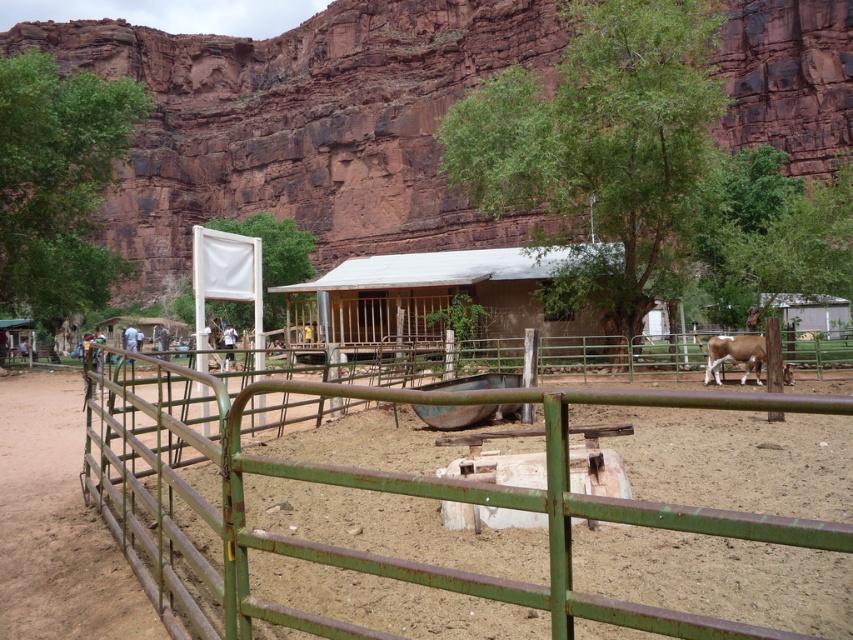
You are a farmer who needs to place a new water trough between the rusty metal fence at lower left and the brown wooden hut at center. The trough requires 2 meters of space on all sides. Is there enough space between the two objects to place it?

The distance between the rusty metal fence at lower left and the brown wooden hut at center is 18.45 meters. Subtracting the required 2 meters of space on both ends, there is 14.45 meters remaining, which is more than enough to place the water trough between them.

You are standing in the fenced area of the rural scene and want to move from the point at coordinates point (494, 323) to the point at coordinates point (712, 372). Which direction should you move in relation to the enclosure?

You should move towards the background of the enclosure because point (494, 323) is closer to the camera than point (712, 372), which is further away.

You are standing at the point with coordinates point (345, 262) and want to walk to the cow in the enclosure. Which direction should you move relative to the other point point (560, 589)?

You should move in the direction of point (560, 589) because it is in front of point (345, 262), so moving towards it would lead you closer to the cow in the enclosure.